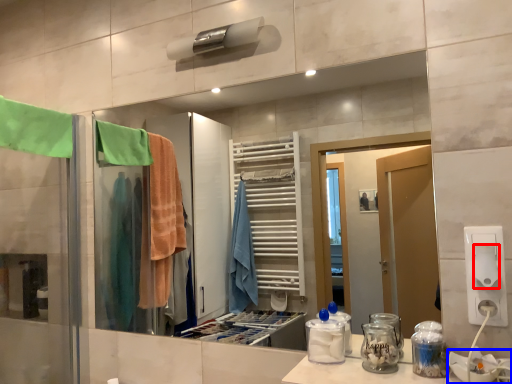
Question: Which point is further to the camera, toilet paper (highlighted by a red box) or sink (highlighted by a blue box)?

Choices:
 (A) toilet paper
 (B) sink

Answer: (A)